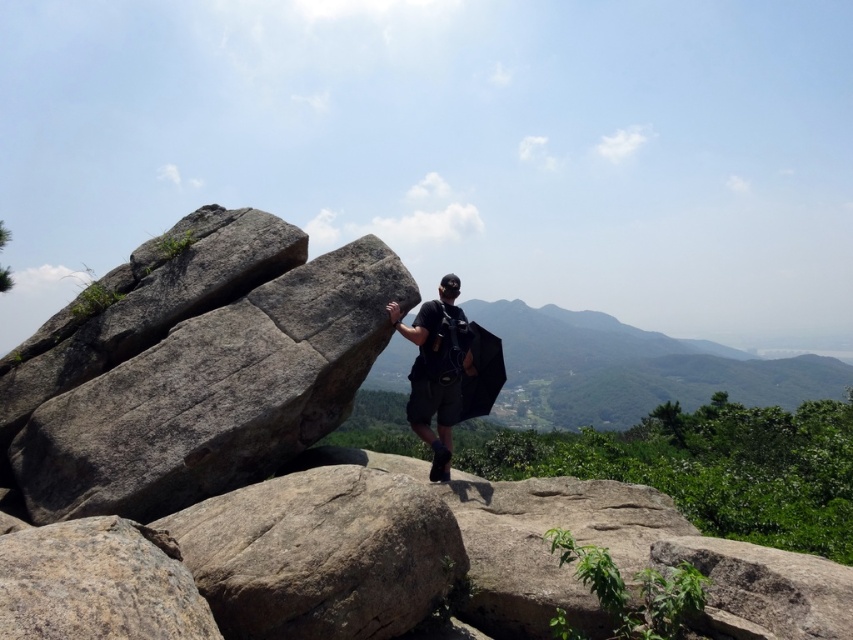
You are a hiker who wants to place your black matte backpack at center on the gray rough boulder at lower left. Can you do that without moving more than 3 meters?

The gray rough boulder at lower left and black matte backpack at center are 3.74 meters apart. Since the distance is more than 3 meters, you cannot place the backpack on the boulder without moving more than 3 meters.

You are a hiker who wants to move from the gray rough rock at left to the gray rough boulder at center. Given that your average step length is 2.5 feet, how many steps would you need to take to reach the boulder?

The distance between the gray rough rock at left and the gray rough boulder at center is 6.08 feet. Dividing this distance by your step length of 2.5 feet gives approximately 2.43 steps. Since you can only take whole steps, you would need to take 3 steps to reach the boulder.